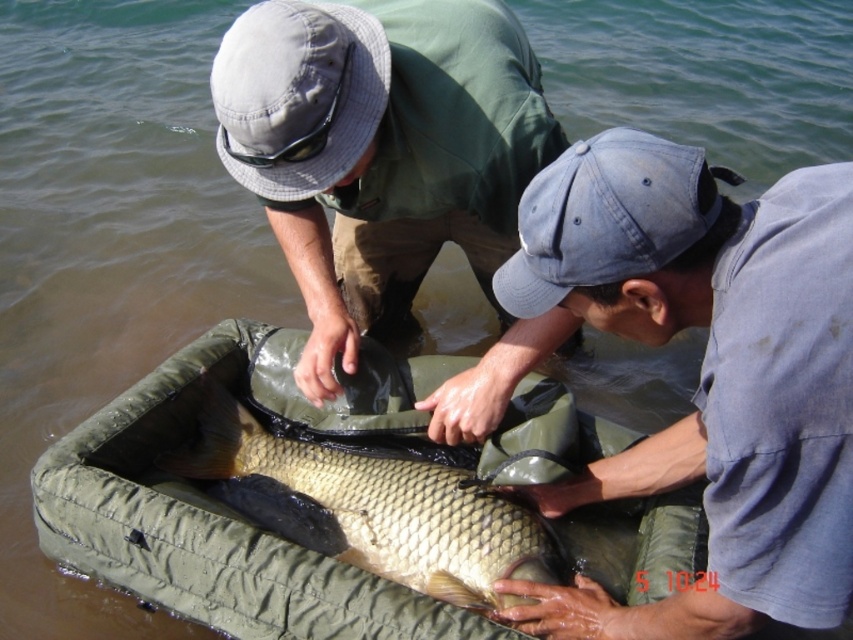
Please describe the position of the blue denim cap at center in the image using the coordinate system where the bottom left corner is the origin point. The coordinate system has a width of 1 unit and a height of 1 unit. The x value is the first number and the y value is the second number. The answer should be in the format of a coordinate pair in parentheses, like this example format answer would be something like this, but not this exact number pair. The answer should be in the format of a coordinate pair.

The blue denim cap at center is located at coordinate point (706,372).

You are a photographer trying to capture a photo of the two people in the fishing scene. You want to ensure both the blue denim cap at center and the denim baseball cap at lower right are visible in the frame. Based on their positions, which cap should you focus on first to include both in the shot?

The blue denim cap at center is to the right of the denim baseball cap at lower right, so focusing on the denim baseball cap at lower right first would allow you to frame both caps since it is positioned to the left of the blue denim cap at center.

You are a photographer standing behind the two people in the image. You want to take a photo that includes both the blue denim cap at center and the denim baseball cap at lower right. Which cap should you adjust to ensure both are fully visible in the frame?

The blue denim cap at center is in front of the denim baseball cap at lower right. To ensure both are fully visible, you should move the blue denim cap at center slightly backward or the denim baseball cap at lower right slightly forward so they don not block each other.